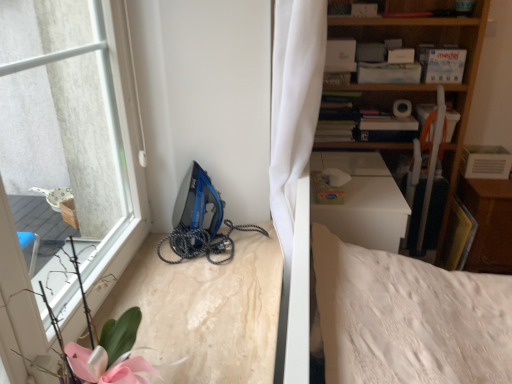
In order to face wooden bookshelf at upper right, should I rotate leftwards or rightwards?

To face it directly, rotate right by 16.930 degrees.

What do you see at coordinates (200, 221) in the screenshot? I see `blue plastic iron at lower left` at bounding box center [200, 221].

At what (x,y) coordinates should I click in order to perform the action: click on wooden dresser at right. Please return your answer as a coordinate pair (x, y). Looking at the image, I should click on (488, 223).

Where is `equipment in front of the wooden bookshelf at upper right`? Image resolution: width=512 pixels, height=384 pixels. equipment in front of the wooden bookshelf at upper right is located at coordinates (200, 221).

Which is behind, blue plastic iron at lower left or wooden bookshelf at upper right?

Positioned behind is wooden bookshelf at upper right.

From a real-world perspective, is blue plastic iron at lower left over wooden bookshelf at upper right?

Yes, from a real-world perspective, blue plastic iron at lower left is on top of wooden bookshelf at upper right.

Would you say wooden dresser at right is part of blue plastic iron at lower left's contents?

No, wooden dresser at right is not surrounded by blue plastic iron at lower left.

In the scene shown: Considering the relative positions of blue plastic iron at lower left and wooden dresser at right in the image provided, is blue plastic iron at lower left to the left of wooden dresser at right from the viewer's perspective?

Indeed, blue plastic iron at lower left is positioned on the left side of wooden dresser at right.

Is blue plastic iron at lower left beside wooden dresser at right?

blue plastic iron at lower left is not next to wooden dresser at right, and they're not touching.

Where is `dresser below the blue plastic iron at lower left (from the image's perspective)`? The image size is (512, 384). dresser below the blue plastic iron at lower left (from the image's perspective) is located at coordinates pos(488,223).

Considering the sizes of objects wooden bookshelf at upper right and wooden dresser at right in the image provided, who is taller, wooden bookshelf at upper right or wooden dresser at right?

Standing taller between the two is wooden bookshelf at upper right.

Is wooden bookshelf at upper right facing away from wooden dresser at right?

No.

Can you confirm if wooden bookshelf at upper right is smaller than wooden dresser at right?

Actually, wooden bookshelf at upper right might be larger than wooden dresser at right.

Would you say wooden dresser at right is part of wooden bookshelf at upper right's contents?

No, wooden dresser at right is not surrounded by wooden bookshelf at upper right.

Is wooden bookshelf at upper right outside of blue plastic iron at lower left?

Indeed, wooden bookshelf at upper right is completely outside blue plastic iron at lower left.

Can you confirm if wooden bookshelf at upper right is taller than blue plastic iron at lower left?

Correct, wooden bookshelf at upper right is much taller as blue plastic iron at lower left.

Considering the positions of objects wooden bookshelf at upper right and blue plastic iron at lower left in the image provided, who is behind, wooden bookshelf at upper right or blue plastic iron at lower left?

wooden bookshelf at upper right is further away from the camera.

Does wooden dresser at right have a greater width compared to blue plastic iron at lower left?

Correct, the width of wooden dresser at right exceeds that of blue plastic iron at lower left.

Considering the sizes of objects wooden dresser at right and blue plastic iron at lower left in the image provided, who is bigger, wooden dresser at right or blue plastic iron at lower left?

Bigger between the two is wooden dresser at right.

From a real-world perspective, is wooden dresser at right physically below blue plastic iron at lower left?

Yes, from a real-world perspective, wooden dresser at right is under blue plastic iron at lower left.

Based on the photo, does wooden dresser at right have a larger size compared to wooden bookshelf at upper right?

Incorrect, wooden dresser at right is not larger than wooden bookshelf at upper right.

Considering the sizes of objects wooden dresser at right and wooden bookshelf at upper right in the image provided, who is wider, wooden dresser at right or wooden bookshelf at upper right?

wooden dresser at right is wider.

From a real-world perspective, between wooden dresser at right and wooden bookshelf at upper right, who is vertically lower?

wooden dresser at right is physically lower.

Based on the photo, is wooden dresser at right behind wooden bookshelf at upper right?

Yes, wooden dresser at right is further from the camera.

Find the location of `shelf below the blue plastic iron at lower left (from a real-world perspective)`. shelf below the blue plastic iron at lower left (from a real-world perspective) is located at coordinates (434, 43).

Where is `equipment on the left of wooden dresser at right`? The height and width of the screenshot is (384, 512). equipment on the left of wooden dresser at right is located at coordinates (200, 221).

When comparing their distances from blue plastic iron at lower left, does wooden dresser at right or wooden bookshelf at upper right seem further?

wooden dresser at right is further to blue plastic iron at lower left.

Which object lies nearer to the anchor point wooden bookshelf at upper right, wooden dresser at right or blue plastic iron at lower left?

wooden dresser at right lies closer to wooden bookshelf at upper right than the other object.

Which object lies further to the anchor point blue plastic iron at lower left, wooden bookshelf at upper right or wooden dresser at right?

wooden dresser at right is further to blue plastic iron at lower left.

Estimate the real-world distances between objects in this image. Which object is further from wooden bookshelf at upper right, blue plastic iron at lower left or wooden dresser at right?

blue plastic iron at lower left lies further to wooden bookshelf at upper right than the other object.

Consider the image. Considering their positions, is blue plastic iron at lower left positioned further to wooden dresser at right than wooden bookshelf at upper right?

Based on the image, blue plastic iron at lower left appears to be further to wooden dresser at right.

When comparing their distances from wooden dresser at right, does wooden bookshelf at upper right or blue plastic iron at lower left seem further?

blue plastic iron at lower left is positioned further to the anchor wooden dresser at right.

The image size is (512, 384). In order to click on shelf between blue plastic iron at lower left and wooden dresser at right in this screenshot , I will do `click(434, 43)`.